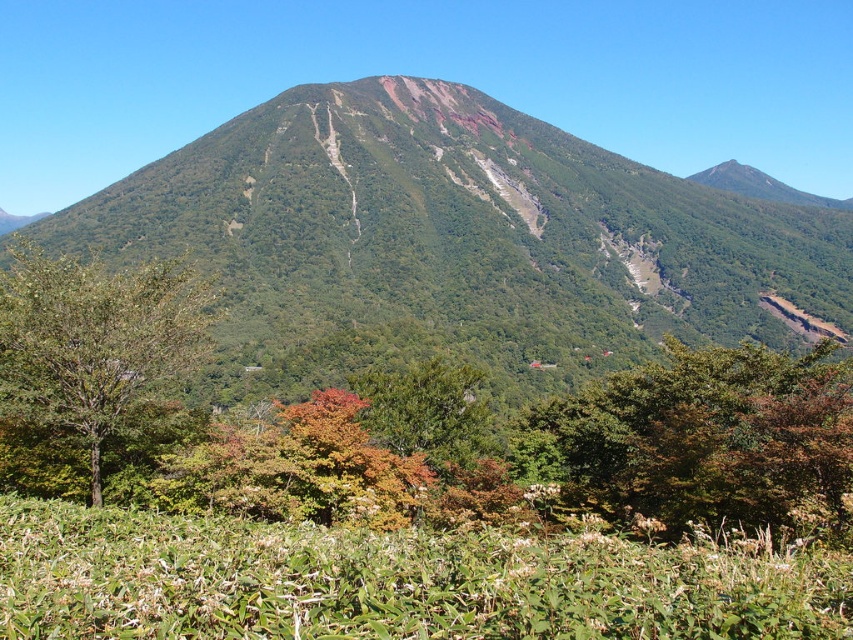
Can you confirm if green leafy tree at center is positioned above green matte tree at center?

Yes.

Does green leafy tree at center appear on the left side of green matte tree at center?

In fact, green leafy tree at center is to the right of green matte tree at center.

At what (x,y) coordinates should I click in order to perform the action: click on green leafy tree at center. Please return your answer as a coordinate pair (x, y). Looking at the image, I should click on (712, 438).

The image size is (853, 640). I want to click on green leafy tree at center, so point(712,438).

Can you confirm if green leafy tree at center is smaller than green matte tree at lower left?

Indeed, green leafy tree at center has a smaller size compared to green matte tree at lower left.

Who is more distant from viewer, (726,493) or (160,276)?

The point (160,276) is behind.

The width and height of the screenshot is (853, 640). I want to click on green leafy tree at center, so click(712, 438).

Based on the photo, who is positioned more to the right, green textured mountain at center or green matte tree at lower left?

green textured mountain at center

The height and width of the screenshot is (640, 853). Describe the element at coordinates (456, 243) in the screenshot. I see `green textured mountain at center` at that location.

Identify the location of green textured mountain at center. Image resolution: width=853 pixels, height=640 pixels. (456, 243).